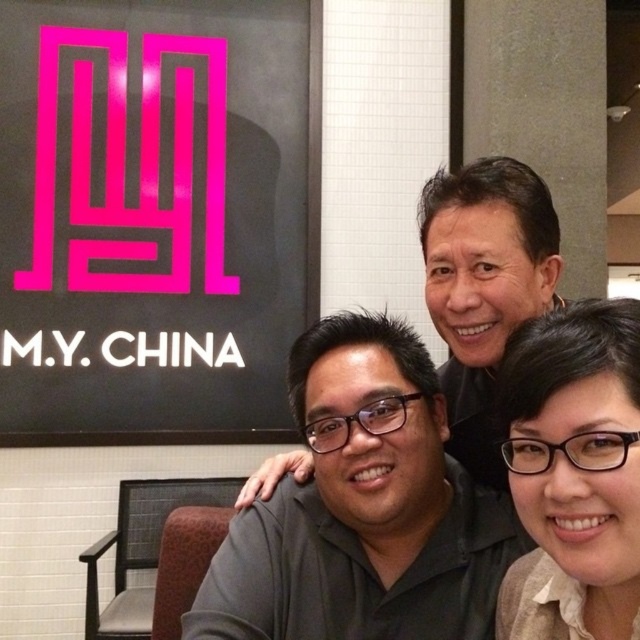
Which is below, matte black shirt at center or matte black glasses at lower right?

matte black shirt at center is lower down.

Does matte black shirt at center have a smaller size compared to matte black glasses at lower right?

Incorrect, matte black shirt at center is not smaller in size than matte black glasses at lower right.

This screenshot has width=640, height=640. Identify the location of matte black shirt at center. tap(364, 509).